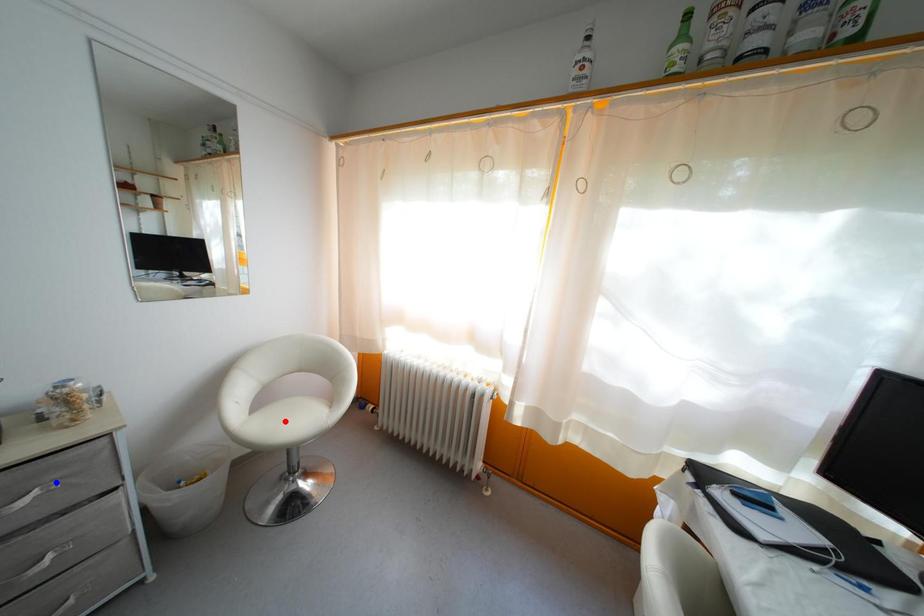
Question: Which of the two points in the image is closer to the camera?

Choices:
 (A) Blue point is closer.
 (B) Red point is closer.

Answer: (A)